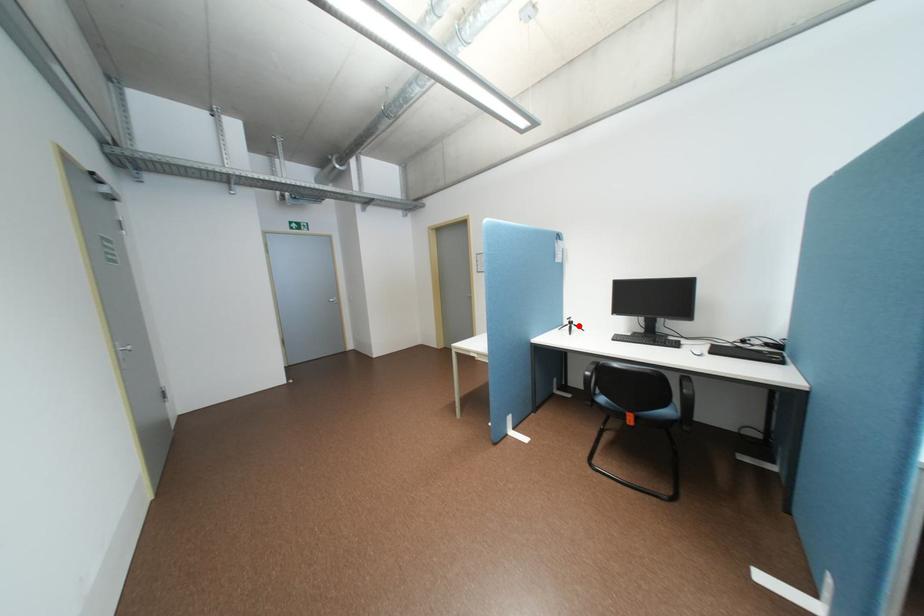
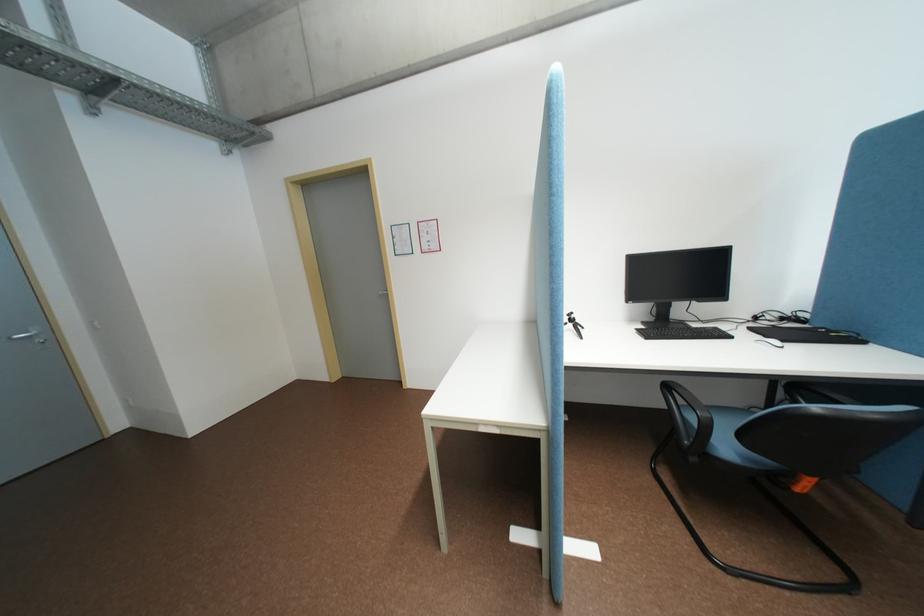
Locate, in the second image, the point that corresponds to the highlighted location in the first image.

(581, 325)